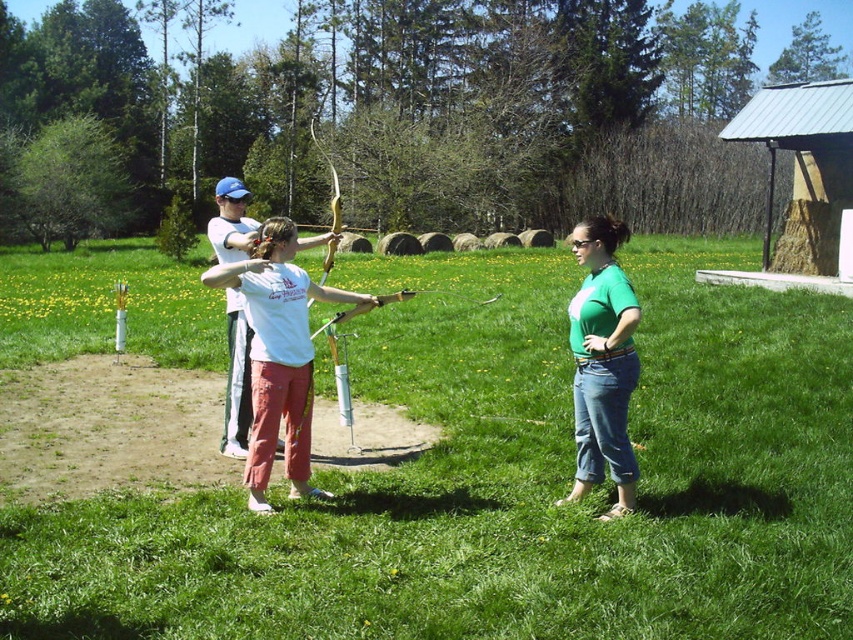
Which is above, green matte shirt at center or wooden bow at center?

wooden bow at center is higher up.

Is green matte shirt at center in front of wooden bow at center?

Yes, it is.

Between point (637, 364) and point (386, 294), which one is positioned in front?

Point (637, 364)

This screenshot has height=640, width=853. I want to click on green matte shirt at center, so click(x=602, y=364).

Is white matte shirt at center taller than green matte shirt at center?

Indeed, white matte shirt at center has a greater height compared to green matte shirt at center.

Can you confirm if white matte shirt at center is positioned below green matte shirt at center?

Yes, white matte shirt at center is below green matte shirt at center.

Identify the location of white matte shirt at center. (277, 355).

Image resolution: width=853 pixels, height=640 pixels. I want to click on green grass at center, so click(508, 481).

Where is `green grass at center`? green grass at center is located at coordinates 508,481.